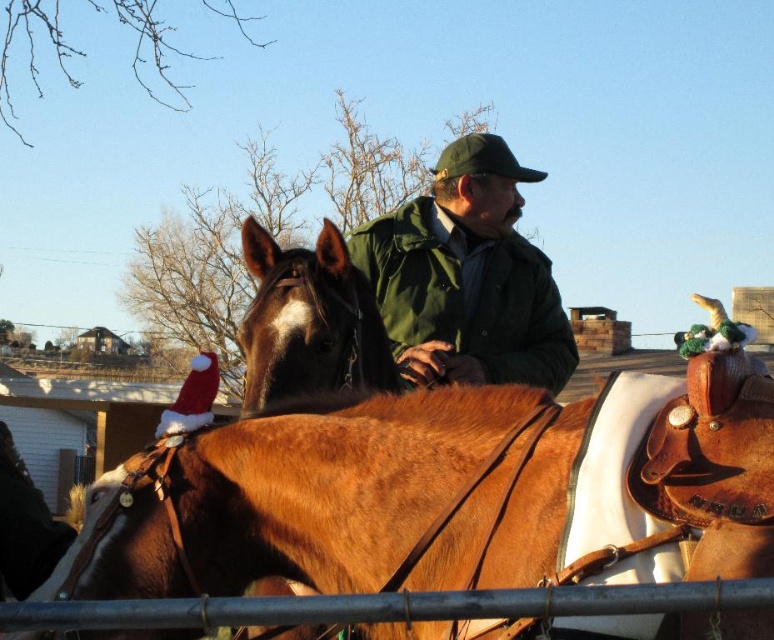
The image size is (774, 640). What do you see at coordinates (447, 493) in the screenshot? I see `brown leather saddle at center` at bounding box center [447, 493].

Can you confirm if brown leather saddle at center is bigger than brown leather horse at center?

Indeed, brown leather saddle at center has a larger size compared to brown leather horse at center.

Is point (625, 570) in front of point (269, 250)?

Yes, point (625, 570) is in front of point (269, 250).

This screenshot has height=640, width=774. I want to click on brown leather saddle at center, so click(447, 493).

Is point (611, 634) closer to camera compared to point (488, 362)?

Yes, it is in front of point (488, 362).

Between brown leather saddle at center and green matte jacket at center, which one is positioned higher?

green matte jacket at center is above.

Who is more forward, (217,484) or (498,204)?

Point (217,484) is more forward.

Image resolution: width=774 pixels, height=640 pixels. In order to click on brown leather saddle at center in this screenshot , I will do `click(447, 493)`.

Which is behind, point (481, 252) or point (322, 301)?

Point (481, 252)

Locate an element on the screen. green matte jacket at center is located at coordinates (466, 276).

Where is `green matte jacket at center`? This screenshot has height=640, width=774. green matte jacket at center is located at coordinates (466, 276).

You are a GUI agent. You are given a task and a screenshot of the screen. Output one action in this format:
    pyautogui.click(x=<x>, y=<y>)
    Task: Click on the green matte jacket at center
    The height and width of the screenshot is (640, 774).
    Given the screenshot: What is the action you would take?
    pyautogui.click(x=466, y=276)